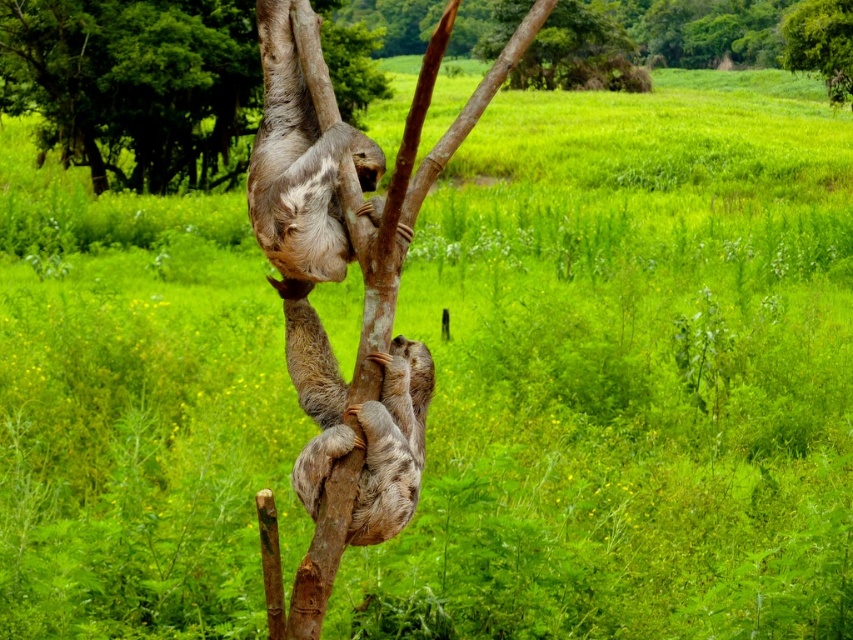
Question: Is brown rough tree trunk at upper center bigger than green leafy tree at upper right?

Choices:
 (A) yes
 (B) no

Answer: (A)

Question: Which point is farther to the camera?

Choices:
 (A) (368, 445)
 (B) (798, 13)
 (C) (184, 33)

Answer: (B)

Question: Which point is closer to the camera?

Choices:
 (A) brown fuzzy sloth at center
 (B) green leafy tree at upper right

Answer: (A)

Question: Is brown rough tree trunk at upper center smaller than brown fuzzy sloth at center?

Choices:
 (A) yes
 (B) no

Answer: (A)

Question: Which point is closer to the camera?

Choices:
 (A) (39, 102)
 (B) (404, 340)
 (C) (793, 65)

Answer: (B)

Question: Is brown rough tree trunk at upper center smaller than green leafy tree at upper right?

Choices:
 (A) no
 (B) yes

Answer: (A)